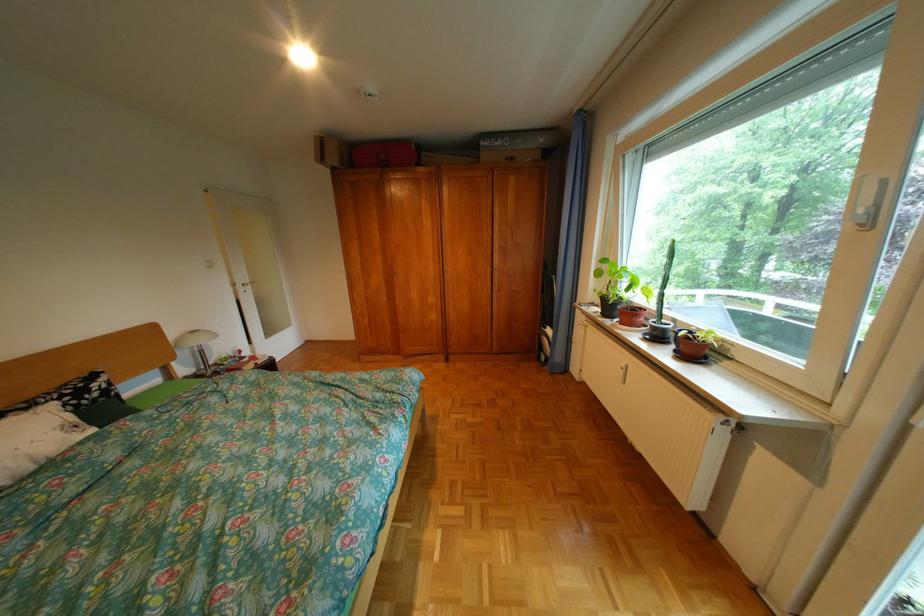
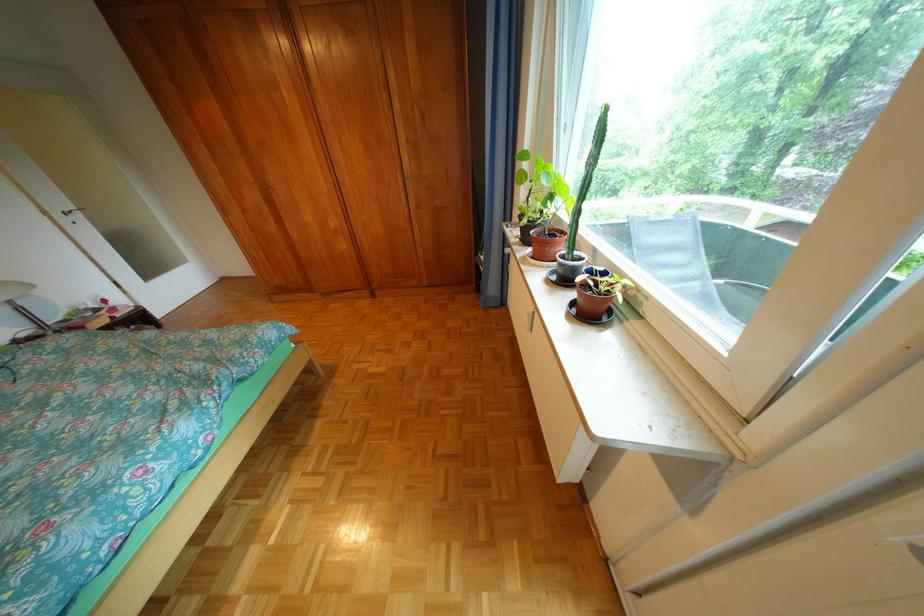
Where in the second image is the point corresponding to point 660,334 from the first image?

(566, 273)